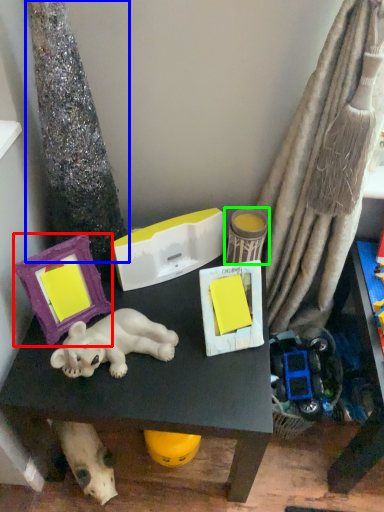
Question: Based on their relative distances, which object is nearer to picture frame (highlighted by a red box)? Choose from tree trunk (highlighted by a blue box) and toy (highlighted by a green box).

Choices:
 (A) tree trunk
 (B) toy

Answer: (A)